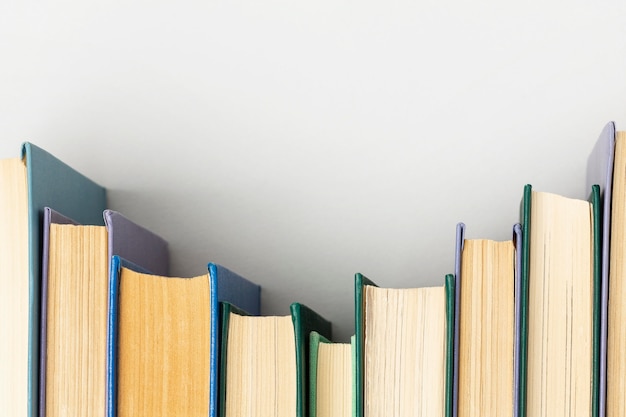
The width and height of the screenshot is (626, 417). Identify the location of green books. (287, 360), (322, 372), (381, 341), (545, 259).